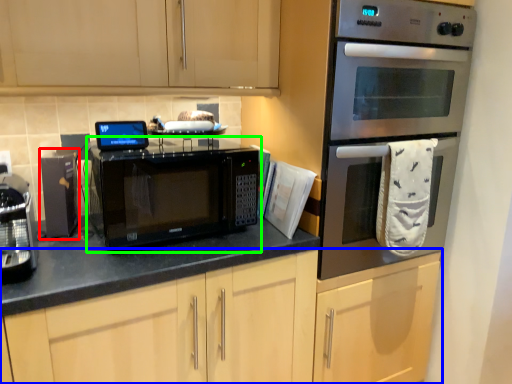
Question: Which object is the farthest from appliance (highlighted by a red box)? Choose among these: cabinetry (highlighted by a blue box) or microwave oven (highlighted by a green box).

Choices:
 (A) cabinetry
 (B) microwave oven

Answer: (A)